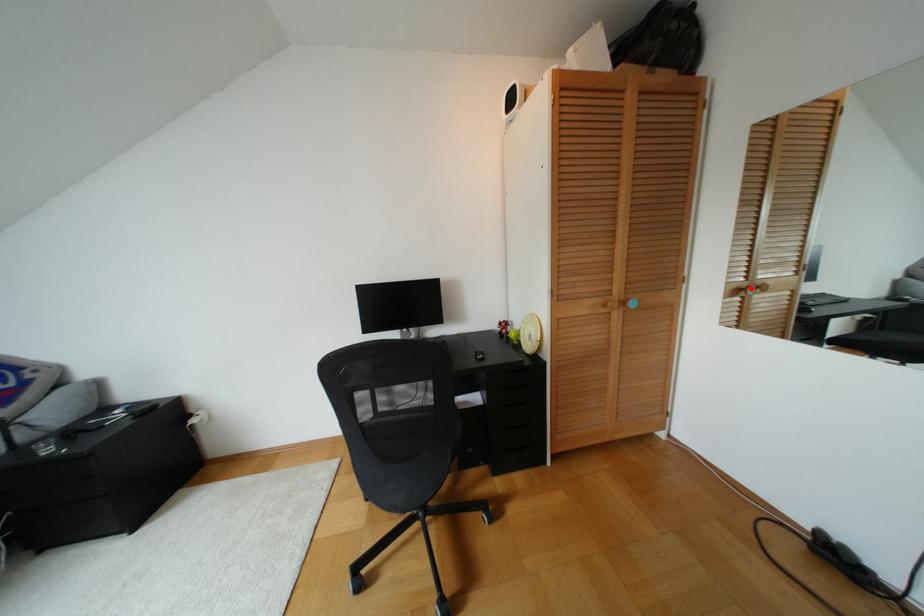
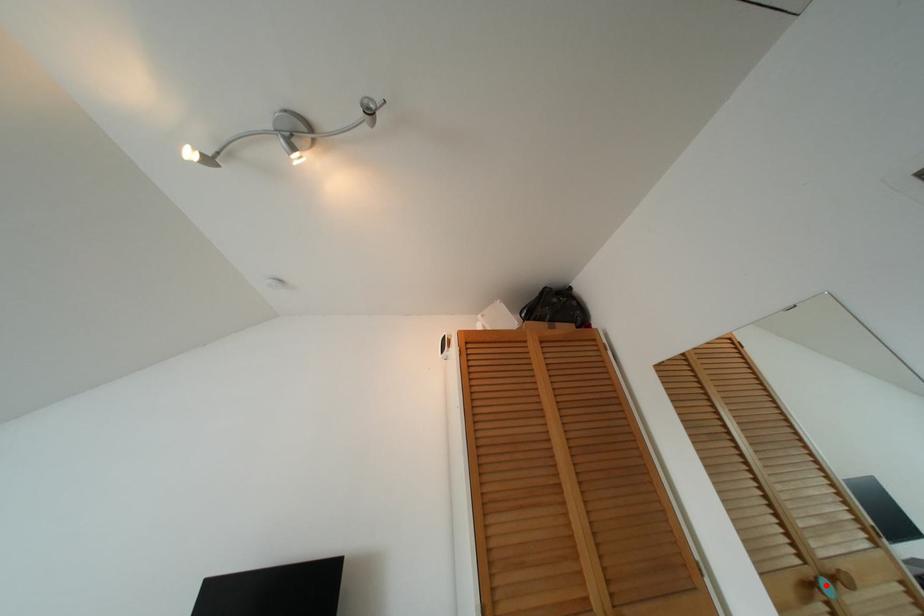
I am providing you with two images of the same scene from different viewpoints. A red point is marked on the first image and another point is marked on the second image. Is the marked point in image1 the same physical position as the marked point in image2?

Yes